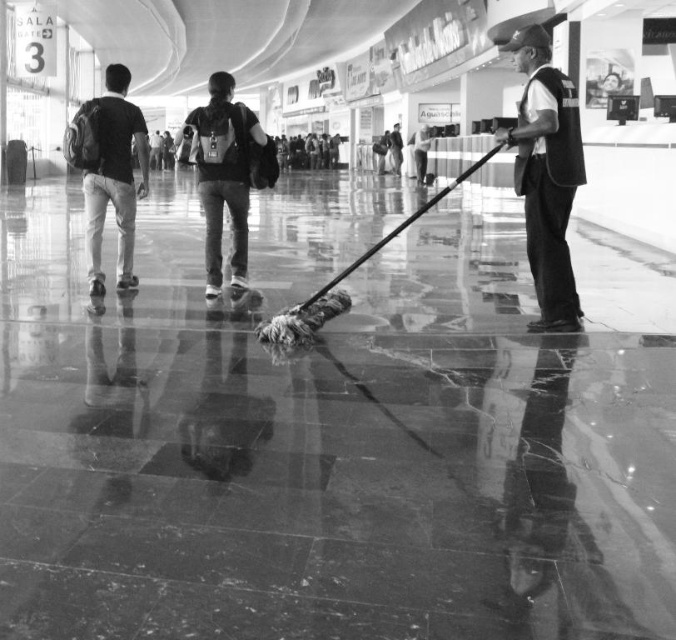
Does dark gray uniform at right have a greater width compared to matte black backpack at center?

In fact, dark gray uniform at right might be narrower than matte black backpack at center.

Describe the element at coordinates (546, 176) in the screenshot. I see `dark gray uniform at right` at that location.

Find the location of a particular element. This screenshot has width=676, height=640. dark gray uniform at right is located at coordinates (546, 176).

Who is positioned more to the left, dark gray uniform at right or matte black backpack at left?

matte black backpack at left

Is point (518, 189) closer to camera compared to point (143, 182)?

Yes.

Locate an element on the screen. Image resolution: width=676 pixels, height=640 pixels. dark gray uniform at right is located at coordinates (546, 176).

Is point (95, 284) farther from camera compared to point (222, 150)?

Yes.

How far apart are matte black backpack at left and matte black backpack at center?

matte black backpack at left and matte black backpack at center are 34.16 inches apart from each other.

Describe the element at coordinates (110, 172) in the screenshot. I see `matte black backpack at left` at that location.

At what (x,y) coordinates should I click in order to perform the action: click on matte black backpack at left. Please return your answer as a coordinate pair (x, y). Looking at the image, I should click on (110, 172).